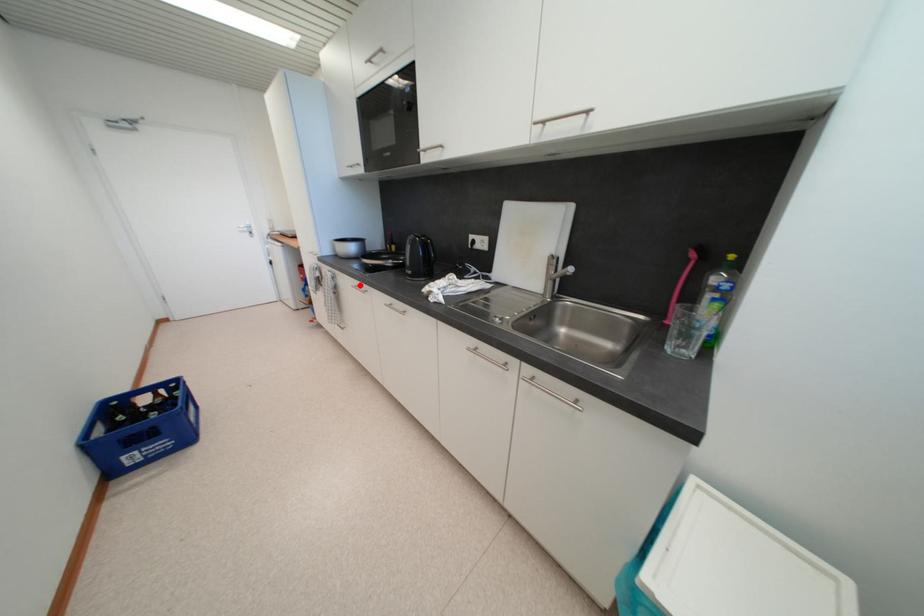
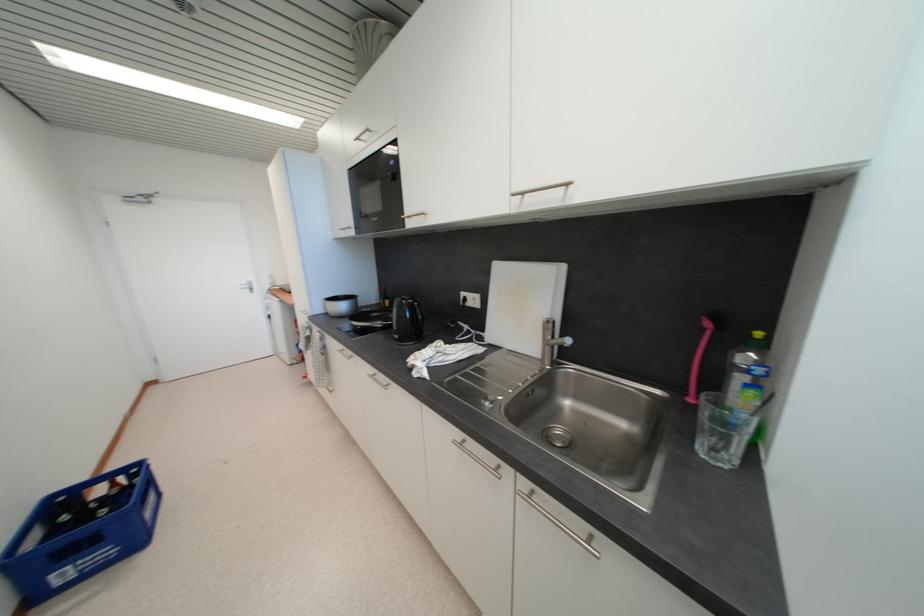
Locate, in the second image, the point that corresponds to the highlighted location in the first image.

(346, 349)